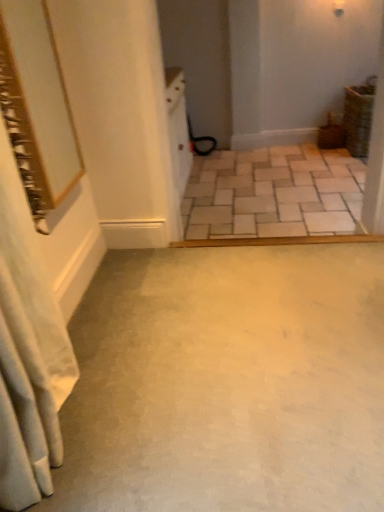
What do you see at coordinates (28, 359) in the screenshot? I see `white fabric shower curtain at left` at bounding box center [28, 359].

Image resolution: width=384 pixels, height=512 pixels. Describe the element at coordinates (273, 193) in the screenshot. I see `beige stone tiles at center, the 2th concrete in the front-to-back sequence` at that location.

Find the location of `white fabric shower curtain at left`. white fabric shower curtain at left is located at coordinates (28, 359).

I want to click on mirror above the white fabric shower curtain at left (from a real-world perspective), so 39,97.

Can you confirm if gold-framed mirror at upper left is thinner than white fabric shower curtain at left?

Yes.

Considering the relative sizes of gold-framed mirror at upper left and white fabric shower curtain at left in the image provided, is gold-framed mirror at upper left smaller than white fabric shower curtain at left?

Indeed, gold-framed mirror at upper left has a smaller size compared to white fabric shower curtain at left.

Is beige stone tiles at center, the 2th concrete in the front-to-back sequence, turned away from smooth concrete floor at center, which is counted as the first concrete, starting from the bottom?

beige stone tiles at center, the 2th concrete in the front-to-back sequence, does not have its back to smooth concrete floor at center, which is counted as the first concrete, starting from the bottom.

Is beige stone tiles at center, marked as the 2th concrete in a bottom-to-top arrangement, wider than smooth concrete floor at center, acting as the second concrete starting from the top?

Yes, beige stone tiles at center, marked as the 2th concrete in a bottom-to-top arrangement, is wider than smooth concrete floor at center, acting as the second concrete starting from the top.

From a real-world perspective, between beige stone tiles at center, positioned as the 1th concrete in top-to-bottom order, and smooth concrete floor at center, which is counted as the first concrete, starting from the bottom, who is vertically lower?

beige stone tiles at center, positioned as the 1th concrete in top-to-bottom order, is physically lower.

What's the angular difference between beige stone tiles at center, the 2th concrete in the front-to-back sequence, and smooth concrete floor at center, placed as the 1th concrete when sorted from front to back,'s facing directions?

The angular difference between beige stone tiles at center, the 2th concrete in the front-to-back sequence, and smooth concrete floor at center, placed as the 1th concrete when sorted from front to back, is 0.109 degrees.

Is beige stone tiles at center, positioned as the 1th concrete in top-to-bottom order, at the back of gold-framed mirror at upper left?

That's not correct — gold-framed mirror at upper left is not looking away from beige stone tiles at center, positioned as the 1th concrete in top-to-bottom order.

Relative to beige stone tiles at center, the 2th concrete in the front-to-back sequence, is gold-framed mirror at upper left in front or behind?

Clearly, gold-framed mirror at upper left is in front of beige stone tiles at center, the 2th concrete in the front-to-back sequence.

Considering the sizes of gold-framed mirror at upper left and beige stone tiles at center, the 2th concrete in the front-to-back sequence, in the image, is gold-framed mirror at upper left taller or shorter than beige stone tiles at center, the 2th concrete in the front-to-back sequence,?

Clearly, gold-framed mirror at upper left is taller compared to beige stone tiles at center, the 2th concrete in the front-to-back sequence.

From the image's perspective, which one is positioned lower, gold-framed mirror at upper left or beige stone tiles at center, marked as the 2th concrete in a bottom-to-top arrangement?

From the image's view, gold-framed mirror at upper left is below.

Is white fabric shower curtain at left located outside gold-framed mirror at upper left?

That's correct, white fabric shower curtain at left is outside of gold-framed mirror at upper left.

What's the angular difference between white fabric shower curtain at left and gold-framed mirror at upper left's facing directions?

The angle between the facing direction of white fabric shower curtain at left and the facing direction of gold-framed mirror at upper left is 0.94 degrees.

Considering their positions, is white fabric shower curtain at left located in front of or behind gold-framed mirror at upper left?

Clearly, white fabric shower curtain at left is in front of gold-framed mirror at upper left.

Is white fabric shower curtain at left oriented away from gold-framed mirror at upper left?

That's not correct — white fabric shower curtain at left is not looking away from gold-framed mirror at upper left.

From the picture: Is smooth concrete floor at center, the second concrete in the back-to-front sequence, next to gold-framed mirror at upper left?

smooth concrete floor at center, the second concrete in the back-to-front sequence, is not next to gold-framed mirror at upper left, and they're not touching.

From a real-world perspective, is smooth concrete floor at center, which is counted as the first concrete, starting from the bottom, physically below gold-framed mirror at upper left?

Indeed, from a real-world perspective, smooth concrete floor at center, which is counted as the first concrete, starting from the bottom, is positioned beneath gold-framed mirror at upper left.

From the picture: Which object is wider, smooth concrete floor at center, placed as the 1th concrete when sorted from front to back, or gold-framed mirror at upper left?

With larger width is smooth concrete floor at center, placed as the 1th concrete when sorted from front to back.

Considering the positions of points (282, 208) and (22, 327), is point (282, 208) closer to camera compared to point (22, 327)?

No, (282, 208) is further to viewer.

You are a GUI agent. You are given a task and a screenshot of the screen. Output one action in this format:
    pyautogui.click(x=<x>, y=<y>)
    Task: Click on the 2nd concrete below the white fabric shower curtain at left (from a real-world perspective)
    
    Given the screenshot: What is the action you would take?
    pyautogui.click(x=273, y=193)

Choose the correct answer: Is beige stone tiles at center, positioned as the 1th concrete in top-to-bottom order, inside white fabric shower curtain at left or outside it?

beige stone tiles at center, positioned as the 1th concrete in top-to-bottom order, cannot be found inside white fabric shower curtain at left.

Does beige stone tiles at center, arranged as the first concrete when viewed from the back, turn towards gold-framed mirror at upper left?

No.

Is beige stone tiles at center, the 2th concrete in the front-to-back sequence, far from gold-framed mirror at upper left?

Yes.

Measure the distance from beige stone tiles at center, arranged as the first concrete when viewed from the back, to gold-framed mirror at upper left.

They are 6.12 feet apart.

Find the location of a particular element. This screenshot has height=512, width=384. shower curtain directly beneath the gold-framed mirror at upper left (from a real-world perspective) is located at coordinates (28, 359).

Find the location of a particular element. Image resolution: width=384 pixels, height=512 pixels. concrete above the smooth concrete floor at center, which is counted as the first concrete, starting from the bottom (from the image's perspective) is located at coordinates (273, 193).

Which object lies further to the anchor point smooth concrete floor at center, acting as the second concrete starting from the top, white fabric shower curtain at left or gold-framed mirror at upper left?

The object further to smooth concrete floor at center, acting as the second concrete starting from the top, is gold-framed mirror at upper left.

From the image, which object appears to be nearer to beige stone tiles at center, arranged as the first concrete when viewed from the back, white fabric shower curtain at left or smooth concrete floor at center, the second concrete in the back-to-front sequence?

smooth concrete floor at center, the second concrete in the back-to-front sequence, is closer to beige stone tiles at center, arranged as the first concrete when viewed from the back.

From the image, which object appears to be nearer to white fabric shower curtain at left, beige stone tiles at center, the 2th concrete in the front-to-back sequence, or smooth concrete floor at center, which is counted as the first concrete, starting from the bottom?

smooth concrete floor at center, which is counted as the first concrete, starting from the bottom, lies closer to white fabric shower curtain at left than the other object.

When comparing their distances from beige stone tiles at center, marked as the 2th concrete in a bottom-to-top arrangement, does gold-framed mirror at upper left or smooth concrete floor at center, which is counted as the first concrete, starting from the bottom, seem further?

The object further to beige stone tiles at center, marked as the 2th concrete in a bottom-to-top arrangement, is gold-framed mirror at upper left.

Considering their positions, is white fabric shower curtain at left positioned further to gold-framed mirror at upper left than beige stone tiles at center, arranged as the first concrete when viewed from the back?

beige stone tiles at center, arranged as the first concrete when viewed from the back, is further to gold-framed mirror at upper left.

Estimate the real-world distances between objects in this image. Which object is further from smooth concrete floor at center, acting as the second concrete starting from the top, gold-framed mirror at upper left or white fabric shower curtain at left?

gold-framed mirror at upper left lies further to smooth concrete floor at center, acting as the second concrete starting from the top, than the other object.

Based on the photo, looking at the image, which one is located further to beige stone tiles at center, positioned as the 1th concrete in top-to-bottom order, smooth concrete floor at center, acting as the second concrete starting from the top, or white fabric shower curtain at left?

white fabric shower curtain at left.

Which object lies nearer to the anchor point smooth concrete floor at center, placed as the 1th concrete when sorted from front to back, white fabric shower curtain at left or beige stone tiles at center, arranged as the first concrete when viewed from the back?

Based on the image, white fabric shower curtain at left appears to be nearer to smooth concrete floor at center, placed as the 1th concrete when sorted from front to back.

Identify the location of mirror between white fabric shower curtain at left and beige stone tiles at center, arranged as the first concrete when viewed from the back, in the front-back direction. (39, 97).

Where is `concrete positioned between white fabric shower curtain at left and beige stone tiles at center, positioned as the 1th concrete in top-to-bottom order, from near to far`? The height and width of the screenshot is (512, 384). concrete positioned between white fabric shower curtain at left and beige stone tiles at center, positioned as the 1th concrete in top-to-bottom order, from near to far is located at coordinates (227, 382).

Locate an element on the screen. The height and width of the screenshot is (512, 384). shower curtain located between gold-framed mirror at upper left and smooth concrete floor at center, acting as the second concrete starting from the top, in the left-right direction is located at coordinates (28, 359).

You are a GUI agent. You are given a task and a screenshot of the screen. Output one action in this format:
    pyautogui.click(x=<x>, y=<y>)
    Task: Click on the mirror between smooth concrete floor at center, which is counted as the first concrete, starting from the bottom, and beige stone tiles at center, the 2th concrete in the front-to-back sequence, along the z-axis
    This screenshot has height=512, width=384.
    Given the screenshot: What is the action you would take?
    pyautogui.click(x=39, y=97)